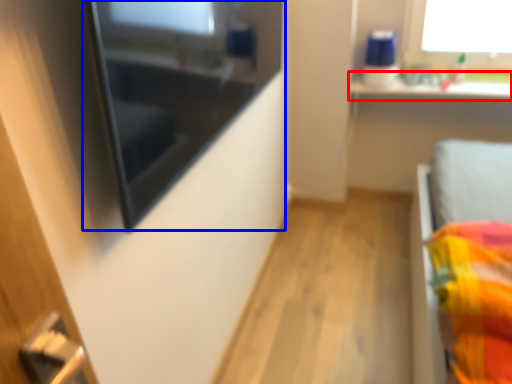
Question: Which of the following is the farthest to the observer, window sill (highlighted by a red box) or medicine cabinet (highlighted by a blue box)?

Choices:
 (A) window sill
 (B) medicine cabinet

Answer: (A)